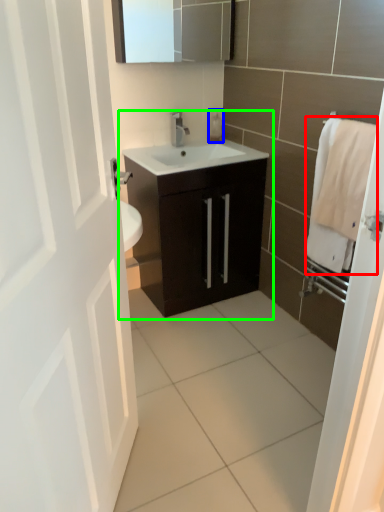
Question: Based on their relative distances, which object is farther from bath towel (highlighted by a red box)? Choose from soap dispenser (highlighted by a blue box) and bathroom cabinet (highlighted by a green box).

Choices:
 (A) soap dispenser
 (B) bathroom cabinet

Answer: (A)